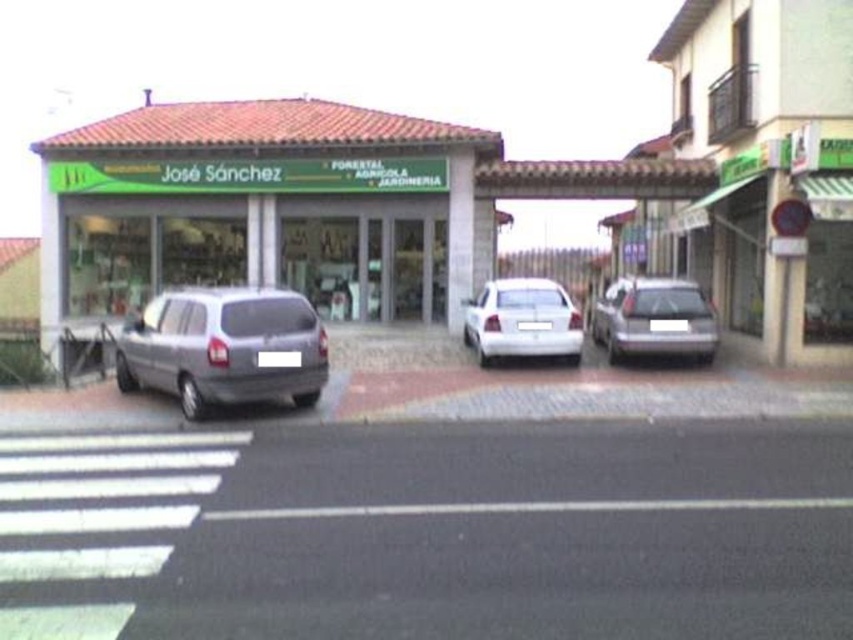
You are standing at the front of the building and want to park your car in the empty space at point (654, 320). Is the space suitable for a sedan?

The point (654, 320) marks a satin silver sedan at center, so the space is already occupied by a sedan. Please choose another spot.

You are a delivery person approaching the green matte storefront at center and the white glossy sedan at center. Based on their heights, which one do you think is closer to the ground?

The white glossy sedan at center is closer to the ground because it is shorter than the green matte storefront at center.

You are a delivery person standing next to the green matte storefront at center. You need to move your delivery cart to the white glossy sedan at center, which is parked 6.55 meters away. The cart requires a minimum of 5 meters of clearance to maneuver safely. Do you have enough space to move the cart directly between them?

The green matte storefront at center and the white glossy sedan at center are 6.55 meters apart, which exceeds the required 5 meters of clearance. Therefore, you have sufficient space to maneuver the delivery cart safely between them.